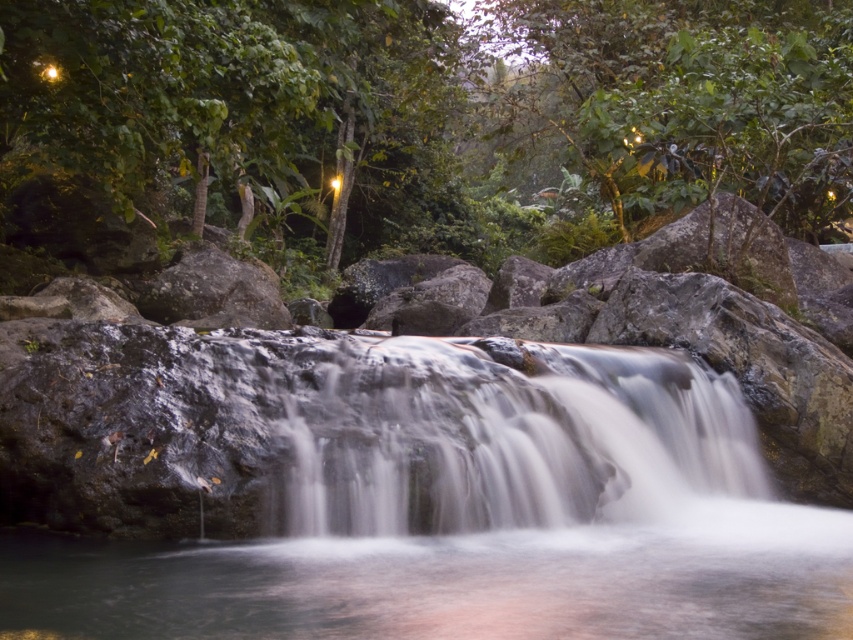
Can you confirm if clear water at center is wider than smooth white water at center?

In fact, clear water at center might be narrower than smooth white water at center.

Who is taller, clear water at center or smooth white water at center?

With more height is smooth white water at center.

Image resolution: width=853 pixels, height=640 pixels. Find the location of `clear water at center`. clear water at center is located at coordinates (451, 582).

The image size is (853, 640). I want to click on clear water at center, so (x=451, y=582).

Is point (212, 349) less distant than point (467, 579)?

No, (212, 349) is further to viewer.

Can you confirm if smooth rock waterfall at center is positioned below clear water at center?

Actually, smooth rock waterfall at center is above clear water at center.

Measure the distance between point (175, 577) and camera.

Point (175, 577) and camera are 15.64 feet apart from each other.

Locate an element on the screen. smooth rock waterfall at center is located at coordinates (399, 493).

Who is taller, smooth rock waterfall at center or smooth white water at center?

smooth rock waterfall at center

Does smooth rock waterfall at center appear over smooth white water at center?

No, smooth rock waterfall at center is not above smooth white water at center.

Does point (585, 548) lie in front of point (553, 428)?

Yes.

Find the location of a particular element. smooth rock waterfall at center is located at coordinates (399, 493).